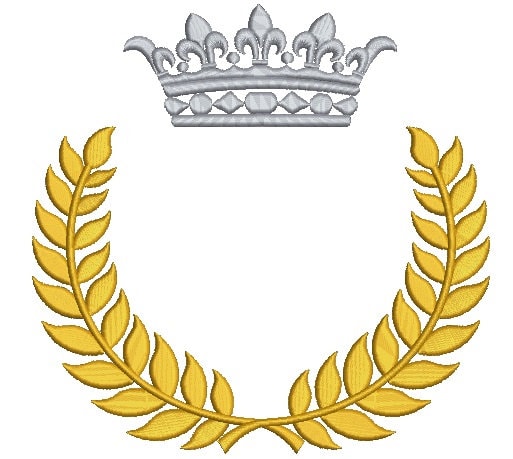
You are a GUI agent. You are given a task and a screenshot of the screen. Output one action in this format:
    pyautogui.click(x=<x>, y=<y>)
    Task: Click on the left yellow plant
    The height and width of the screenshot is (459, 513).
    Given the screenshot: What is the action you would take?
    pyautogui.click(x=152, y=398)